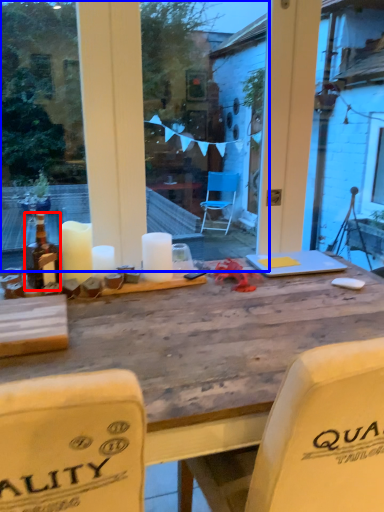
Question: Which object is closer to the camera taking this photo, bottle (highlighted by a red box) or glass window (highlighted by a blue box)?

Choices:
 (A) bottle
 (B) glass window

Answer: (A)